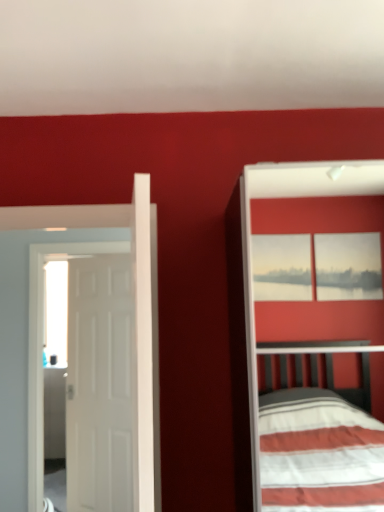
Where is `free point above white matte door at left, which is counted as the 1th door, starting from the front (from a real-world perspective)`? free point above white matte door at left, which is counted as the 1th door, starting from the front (from a real-world perspective) is located at coordinates (61, 202).